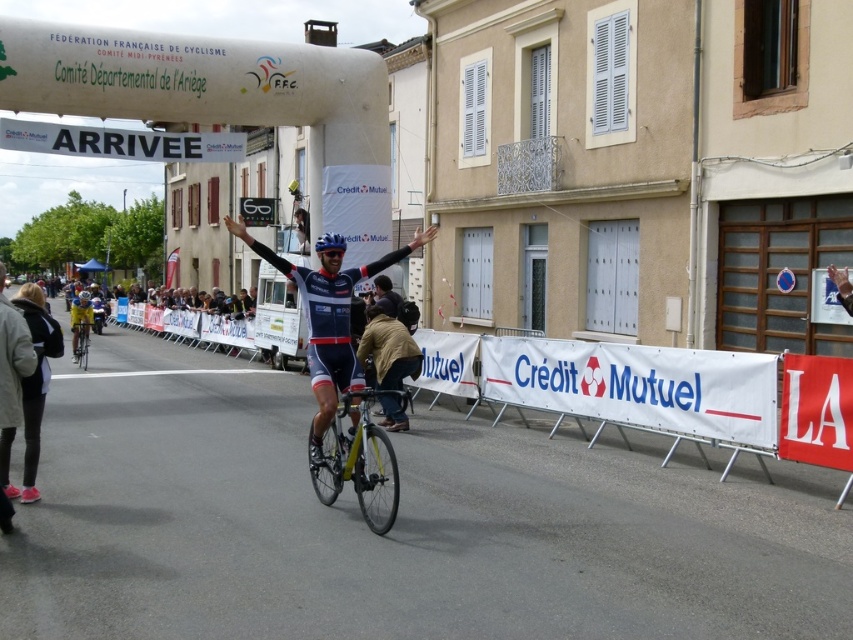
Question: Can you confirm if yellow matte bicycle at center is wider than blue fabric jersey at center?

Choices:
 (A) yes
 (B) no

Answer: (A)

Question: Which object is positioned farthest from the yellow matte bicycle at center?

Choices:
 (A) dark blue jersey at center
 (B) matte blue jersey at center
 (C) yellow metallic bicycle at center
 (D) blue fabric jersey at center

Answer: (C)

Question: Is matte blue jersey at center smaller than dark gray jacket at lower left?

Choices:
 (A) no
 (B) yes

Answer: (B)

Question: Which object appears closest to the camera in this image?

Choices:
 (A) dark blue jersey at center
 (B) dark gray jacket at lower left
 (C) yellow matte bicycle at center

Answer: (C)

Question: Which of the following is the closest to the observer?

Choices:
 (A) yellow matte bicycle at center
 (B) blue fabric jersey at center
 (C) yellow metallic bicycle at center
 (D) dark gray jacket at lower left

Answer: (A)

Question: From the image, what is the correct spatial relationship of yellow matte bicycle at center in relation to yellow metallic bicycle at center?

Choices:
 (A) left
 (B) right

Answer: (B)